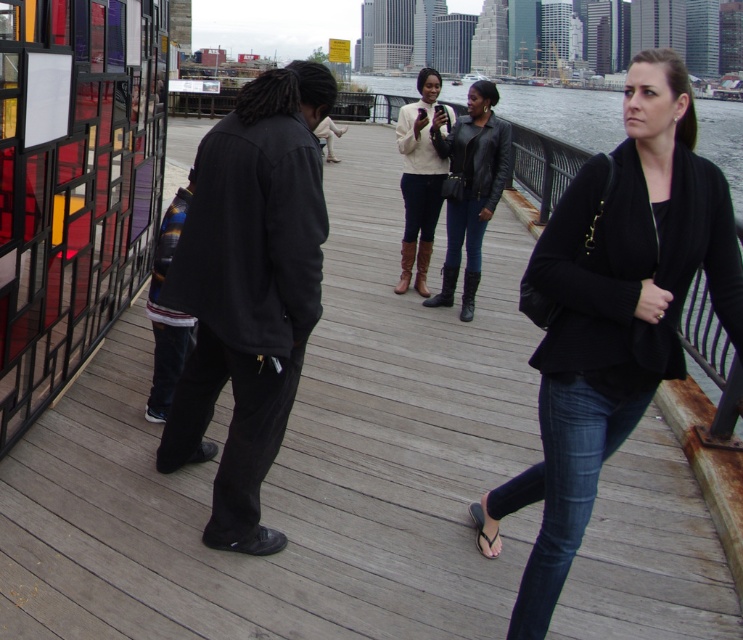
Question: Which object is the closest to the leather jacket at center?

Choices:
 (A) black leather jacket at center
 (B) matte white sweater at center
 (C) black matte jacket at center

Answer: (B)

Question: Is black leather jacket at center above leather jacket at center?

Choices:
 (A) no
 (B) yes

Answer: (A)

Question: Is black matte jacket at center behind leather jacket at center?

Choices:
 (A) no
 (B) yes

Answer: (A)

Question: Which point is closer to the camera?

Choices:
 (A) (435, 182)
 (B) (626, 352)
 (C) (473, 211)

Answer: (B)

Question: Which point appears farthest from the camera in this image?

Choices:
 (A) (415, 134)
 (B) (484, 147)
 (C) (302, 179)

Answer: (A)

Question: Is the position of black leather jacket at center less distant than that of black matte jacket at center?

Choices:
 (A) yes
 (B) no

Answer: (A)